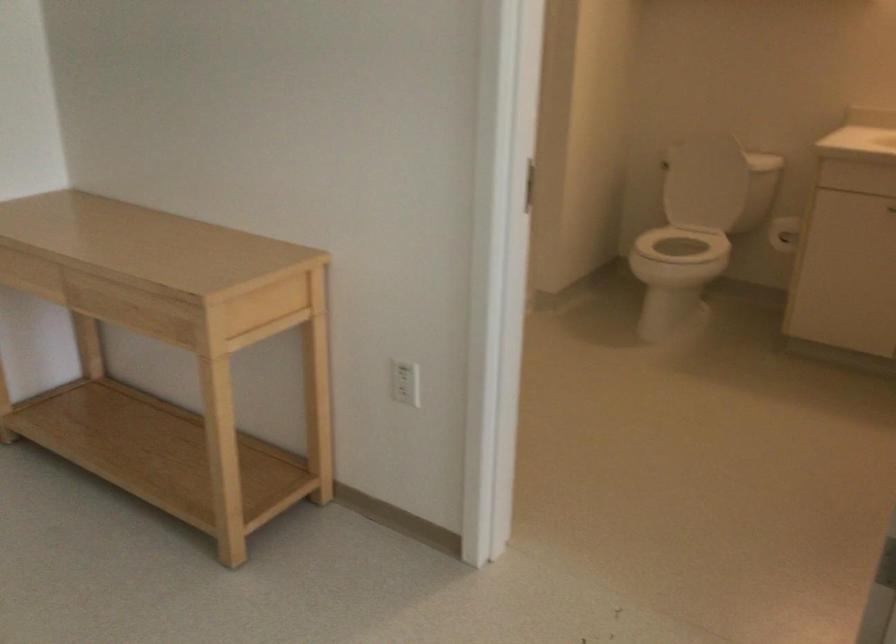
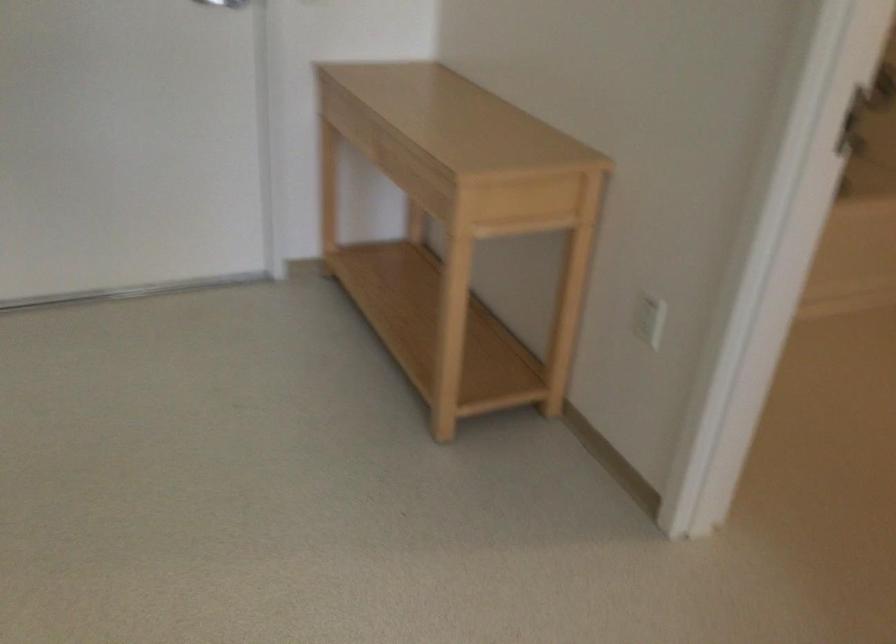
Locate, in the second image, the point that corresponds to (x=407, y=384) in the first image.

(648, 317)